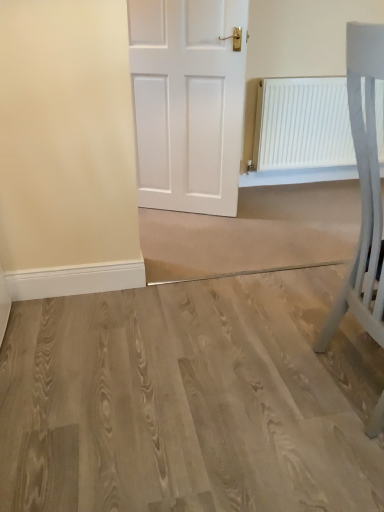
Where is `vacant area to the left of white matte chair at right`? vacant area to the left of white matte chair at right is located at coordinates tap(245, 392).